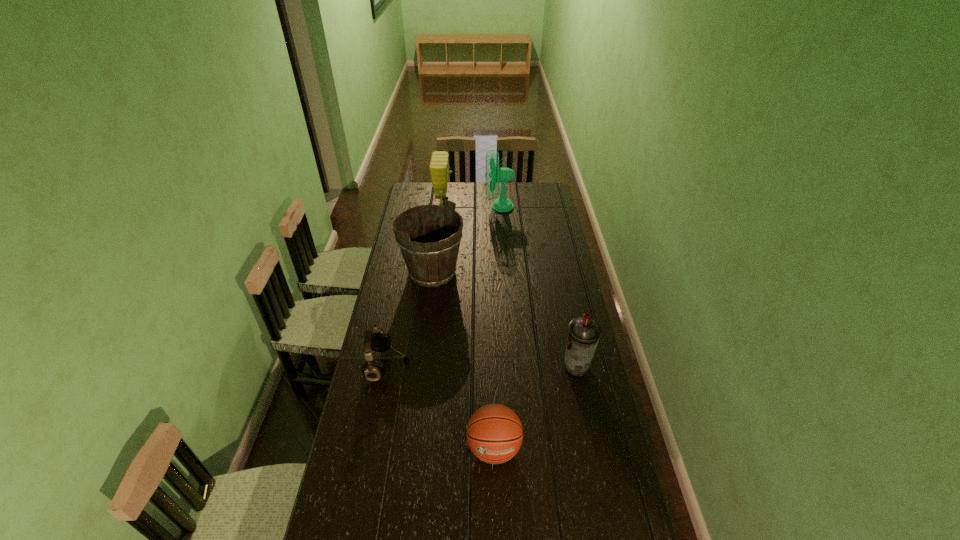
The width and height of the screenshot is (960, 540). Find the location of `vacant position at the right edge of the desktop`. vacant position at the right edge of the desktop is located at coordinates (558, 368).

At what (x,y) coordinates should I click in order to perform the action: click on free space between the aerosol can and the fourth nearest object. Please return your answer as a coordinate pair (x, y). The image size is (960, 540). Looking at the image, I should click on (505, 319).

You are a GUI agent. You are given a task and a screenshot of the screen. Output one action in this format:
    pyautogui.click(x=<x>, y=<y>)
    Task: Click on the vacant area that lies between the fan and the sponge
    
    Given the screenshot: What is the action you would take?
    pyautogui.click(x=471, y=205)

I want to click on empty location between the fan and the rightmost object, so click(x=538, y=286).

Locate an element on the screen. This screenshot has width=960, height=540. blank region between the rightmost object and the bucket is located at coordinates (505, 319).

In order to click on free area in between the sponge and the headset in this screenshot , I will do (416, 285).

Locate an element on the screen. empty location between the fan and the aerosol can is located at coordinates (538, 286).

Locate an element on the screen. free space that is in between the fan and the nearest object is located at coordinates (496, 327).

Find the location of a particular element. free space between the aerosol can and the basketball is located at coordinates (536, 407).

Where is `unoccupied position between the headset and the nearest object`? unoccupied position between the headset and the nearest object is located at coordinates (441, 407).